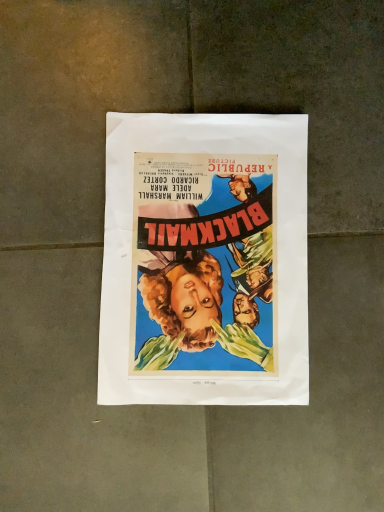
Where is `blank space situated above vintage paper poster at center (from a real-world perspective)`? blank space situated above vintage paper poster at center (from a real-world perspective) is located at coordinates (206, 257).